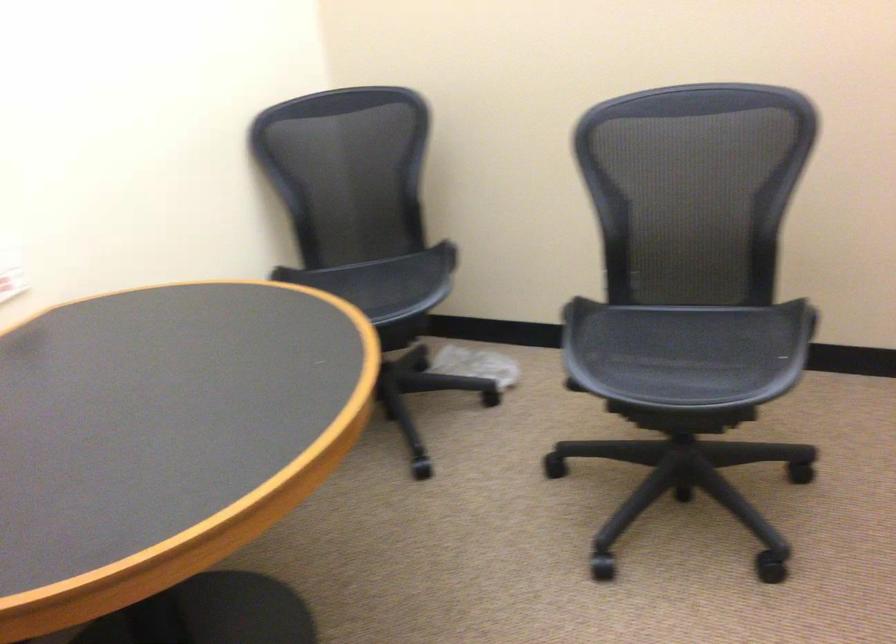
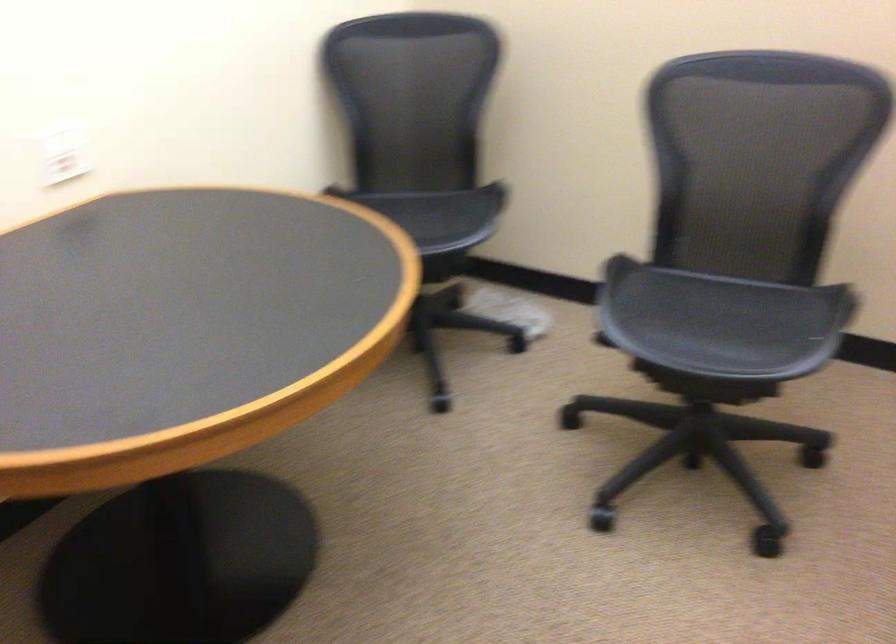
Question: Which direction would the cameraman need to move to produce the second image? Reply with the corresponding letter.

Choices:
 (A) Left
 (B) Right
 (C) Forward
 (D) Backward

Answer: (D)